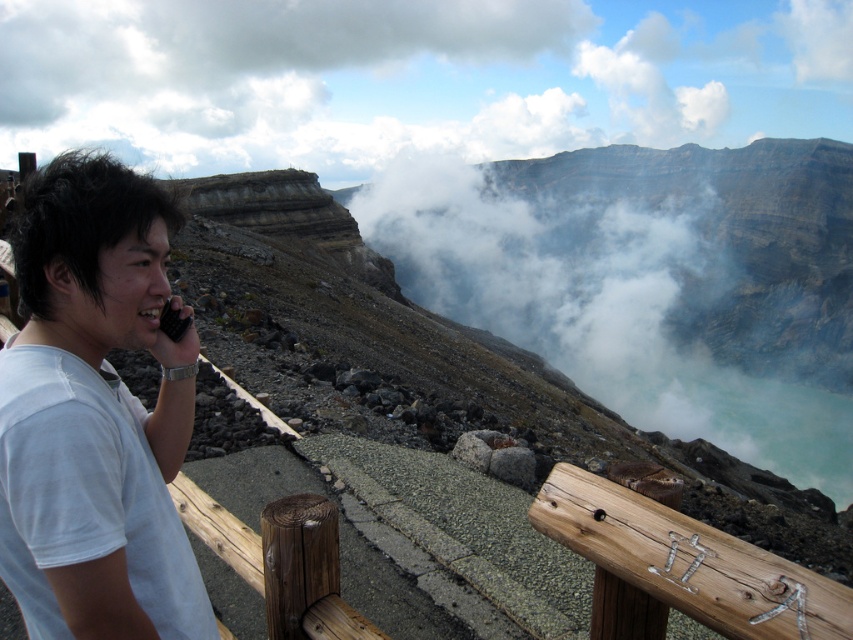
Question: Can you confirm if white cotton shirt at left is bigger than black plastic phone at left?

Choices:
 (A) no
 (B) yes

Answer: (B)

Question: Does white cotton shirt at left have a larger size compared to black plastic phone at left?

Choices:
 (A) yes
 (B) no

Answer: (A)

Question: Among these points, which one is farthest from the camera?

Choices:
 (A) (24, 356)
 (B) (173, 321)

Answer: (B)

Question: Among these objects, which one is nearest to the camera?

Choices:
 (A) white cotton shirt at left
 (B) black plastic phone at left

Answer: (A)

Question: Is the position of white cotton shirt at left more distant than that of black plastic phone at left?

Choices:
 (A) no
 (B) yes

Answer: (A)